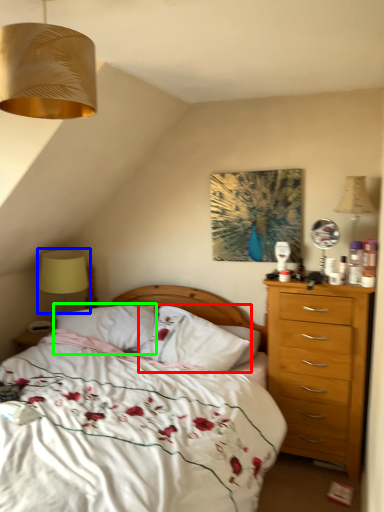
Question: Which object is positioned farthest from pillow (highlighted by a red box)? Select from table lamp (highlighted by a blue box) and pillow (highlighted by a green box).

Choices:
 (A) table lamp
 (B) pillow

Answer: (A)